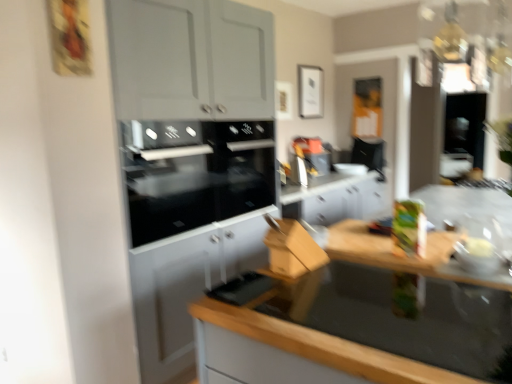
Question: From a real-world perspective, is green matte box at right, marked as the 2th appliance in a front-to-back arrangement, on black glass oven at center, arranged as the third appliance when viewed from the right?

Choices:
 (A) no
 (B) yes

Answer: (A)

Question: Are green matte box at right, which is the 2th appliance from right to left, and black glass oven at center, arranged as the third appliance when viewed from the right, located far from each other?

Choices:
 (A) no
 (B) yes

Answer: (B)

Question: Is the depth of green matte box at right, which is the 2th appliance from right to left, less than that of black glass oven at center, which is counted as the third appliance, starting from the front?

Choices:
 (A) no
 (B) yes

Answer: (B)

Question: Does green matte box at right, acting as the second appliance starting from the back, turn towards black glass oven at center, arranged as the third appliance when viewed from the right?

Choices:
 (A) yes
 (B) no

Answer: (B)

Question: Can you confirm if green matte box at right, which is the 2th appliance from right to left, is wider than black glass oven at center, which ranks as the first appliance in left-to-right order?

Choices:
 (A) yes
 (B) no

Answer: (B)

Question: From a real-world perspective, relative to wooden at lower right, is black glass oven at center, which ranks as the first appliance in left-to-right order, vertically above or below?

Choices:
 (A) below
 (B) above

Answer: (B)

Question: Is black glass oven at center, which is counted as the third appliance, starting from the front, to the left or to the right of wooden at lower right in the image?

Choices:
 (A) left
 (B) right

Answer: (A)

Question: In terms of width, does black glass oven at center, which is counted as the third appliance, starting from the front, look wider or thinner when compared to wooden at lower right?

Choices:
 (A) wide
 (B) thin

Answer: (B)

Question: Considering the positions of black glass oven at center, which ranks as the first appliance in left-to-right order, and wooden at lower right in the image, is black glass oven at center, which ranks as the first appliance in left-to-right order, taller or shorter than wooden at lower right?

Choices:
 (A) tall
 (B) short

Answer: (B)

Question: In terms of width, does green matte box at right, acting as the second appliance starting from the back, look wider or thinner when compared to wooden at lower right?

Choices:
 (A) thin
 (B) wide

Answer: (A)

Question: Would you say green matte box at right, marked as the 2th appliance in a front-to-back arrangement, is to the left or to the right of wooden at lower right in the picture?

Choices:
 (A) left
 (B) right

Answer: (B)

Question: Is green matte box at right, marked as the 2th appliance in a front-to-back arrangement, taller or shorter than wooden at lower right?

Choices:
 (A) tall
 (B) short

Answer: (B)

Question: From a real-world perspective, relative to wooden at lower right, is green matte box at right, the 2th appliance in the left-to-right sequence, vertically above or below?

Choices:
 (A) below
 (B) above

Answer: (B)

Question: Considering the positions of point (347, 273) and point (395, 248), is point (347, 273) closer or farther from the camera than point (395, 248)?

Choices:
 (A) closer
 (B) farther

Answer: (A)

Question: Based on their positions, is wooden at lower right located to the left or right of green matte box at right, the 2th appliance in the left-to-right sequence?

Choices:
 (A) left
 (B) right

Answer: (A)